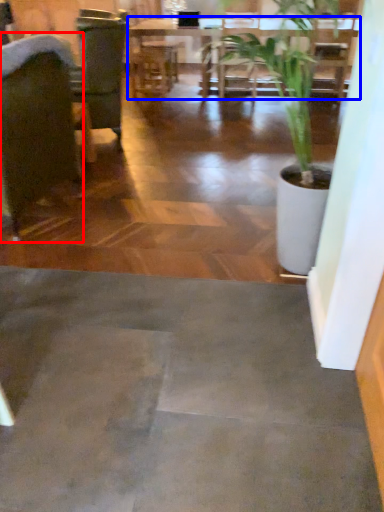
Question: Which object is further to the camera taking this photo, chair (highlighted by a red box) or table (highlighted by a blue box)?

Choices:
 (A) chair
 (B) table

Answer: (B)